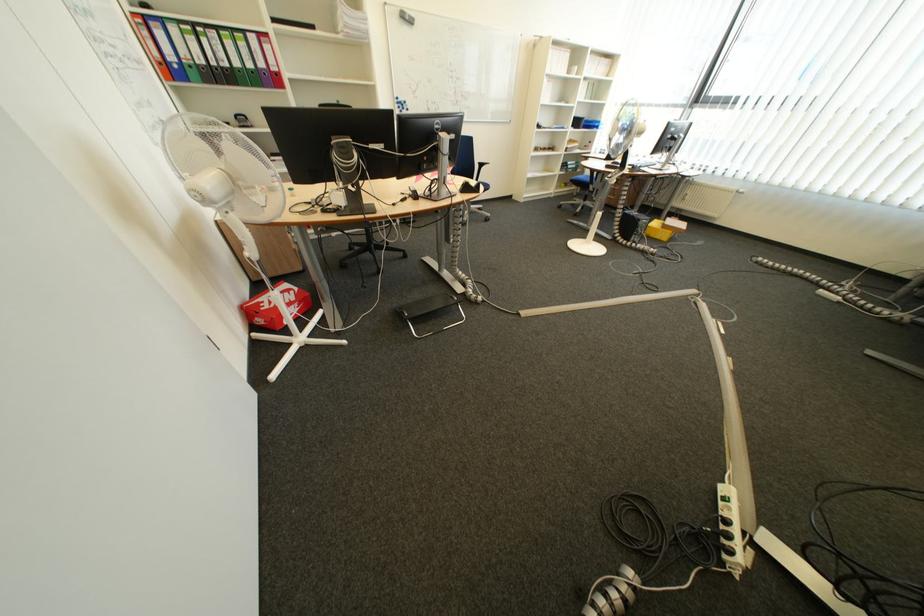
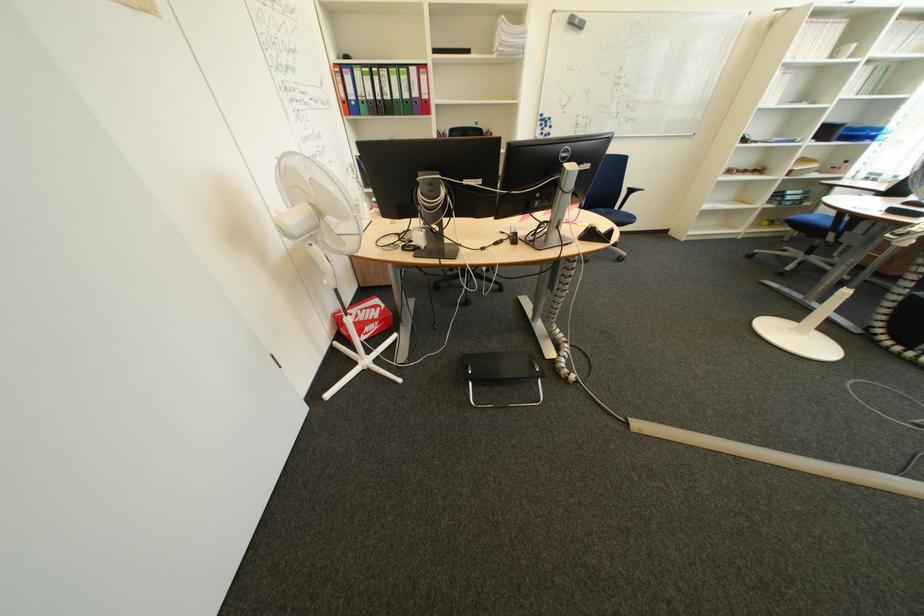
Locate, in the second image, the point that corresponds to (x=306, y=308) in the first image.

(385, 326)